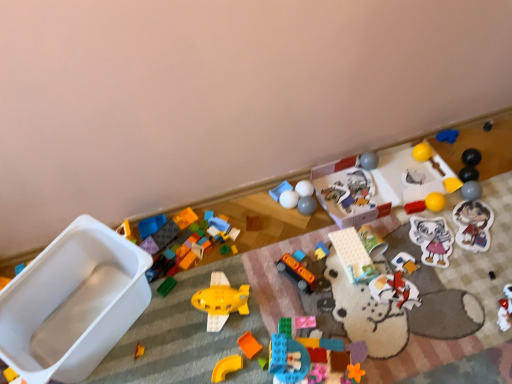
Where is `vacant point to the right of white plastic toy at center, which is the seventeenth toy from left to right`? vacant point to the right of white plastic toy at center, which is the seventeenth toy from left to right is located at coordinates (401, 188).